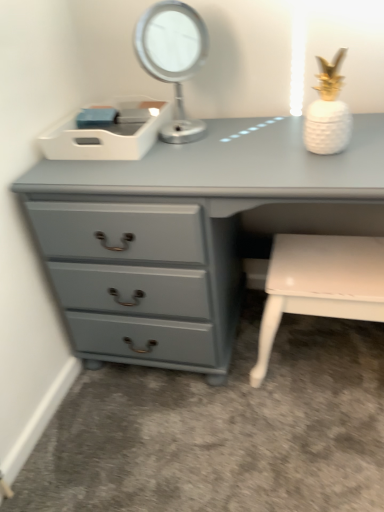
Where is `free point in front of white glossy bench at lower right`? free point in front of white glossy bench at lower right is located at coordinates (311, 447).